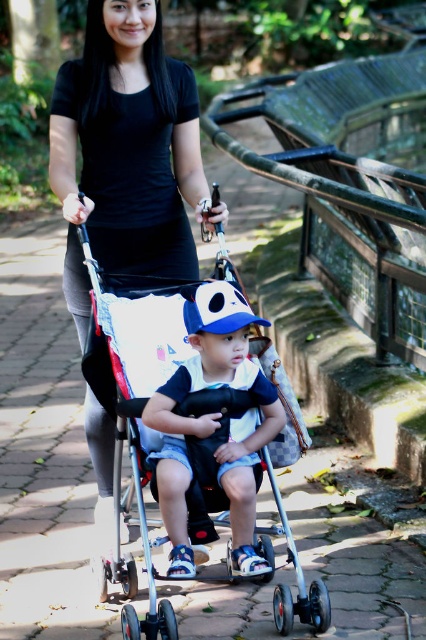
Does black matte dress at center have a greater width compared to matte blue cap at center?

Yes, black matte dress at center is wider than matte blue cap at center.

Who is more distant from viewer, (x=192, y=147) or (x=184, y=369)?

The point (x=192, y=147) is behind.

Identify the location of black matte dress at center. The width and height of the screenshot is (426, 640). (126, 150).

Identify the location of black matte dress at center. (126, 150).

Is silver metallic stroller at center taller than matte blue cap at center?

Correct, silver metallic stroller at center is much taller as matte blue cap at center.

Which is in front, point (114, 330) or point (264, 417)?

Positioned in front is point (264, 417).

Between point (224, 429) and point (242, 563), which one is positioned behind?

Positioned behind is point (224, 429).

Where is `silver metallic stroller at center`? The width and height of the screenshot is (426, 640). silver metallic stroller at center is located at coordinates (201, 426).

Does silver metallic stroller at center have a larger size compared to black matte dress at center?

Indeed, silver metallic stroller at center has a larger size compared to black matte dress at center.

Based on the photo, between silver metallic stroller at center and black matte dress at center, which one appears on the left side from the viewer's perspective?

black matte dress at center

Between point (314, 624) and point (118, 44), which one is positioned behind?

Positioned behind is point (118, 44).

Identify the location of silver metallic stroller at center. (201, 426).